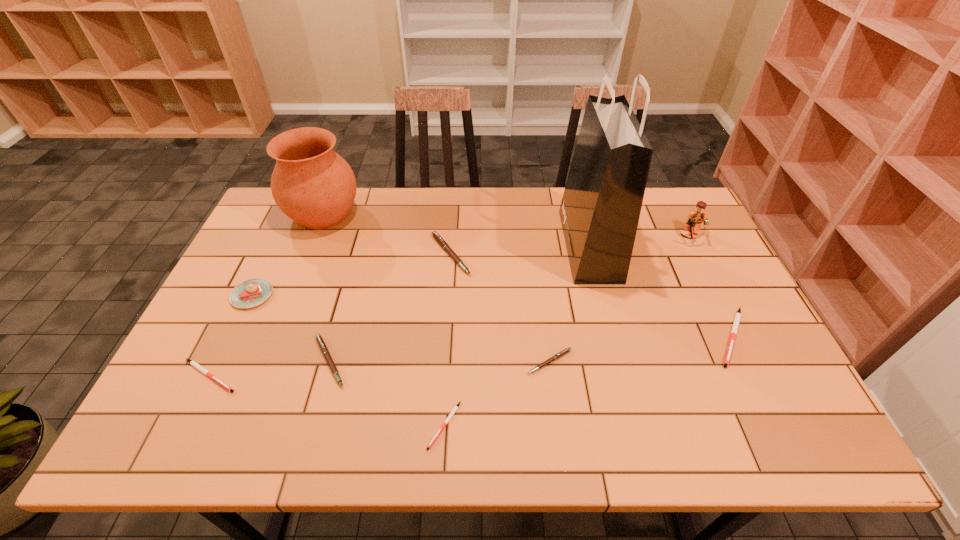
The width and height of the screenshot is (960, 540). Identify the location of empty space that is in between the shortest pen and the second pen from right to left. (497, 393).

This screenshot has width=960, height=540. Find the location of `free space between the leftmost pink pen and the third object from right to left`. free space between the leftmost pink pen and the third object from right to left is located at coordinates (460, 303).

Find the location of `unoccupied area between the second white pen from right to left and the leftmost white pen`. unoccupied area between the second white pen from right to left and the leftmost white pen is located at coordinates (327, 400).

Locate an element on the screen. free space between the seventh object from left to right and the biggest white pen is located at coordinates (640, 349).

Where is `empty location between the shopping bag and the Lego`? The height and width of the screenshot is (540, 960). empty location between the shopping bag and the Lego is located at coordinates (639, 240).

Locate an element on the screen. the fourth closest object to the smallest pink pen is located at coordinates (738, 315).

Point out which object is positioned as the seventh nearest to the second smallest white pen. Please provide its 2D coordinates. Your answer should be formatted as a tuple, i.e. [(x, y)], where the tuple contains the x and y coordinates of a point satisfying the conditions above.

[(600, 209)]

Point out which pen is positioned as the fourth nearest to the second smallest white pen. Please provide its 2D coordinates. Your answer should be formatted as a tuple, i.e. [(x, y)], where the tuple contains the x and y coordinates of a point satisfying the conditions above.

[(563, 352)]

You are a GUI agent. You are given a task and a screenshot of the screen. Output one action in this format:
    pyautogui.click(x=<x>, y=<y>)
    Task: Click on the pen that stands as the third closest to the pottery
    Image resolution: width=960 pixels, height=540 pixels.
    Given the screenshot: What is the action you would take?
    pyautogui.click(x=193, y=363)

Locate an element on the screen. This screenshot has height=540, width=960. the third closest pink pen relative to the biggest white pen is located at coordinates (322, 345).